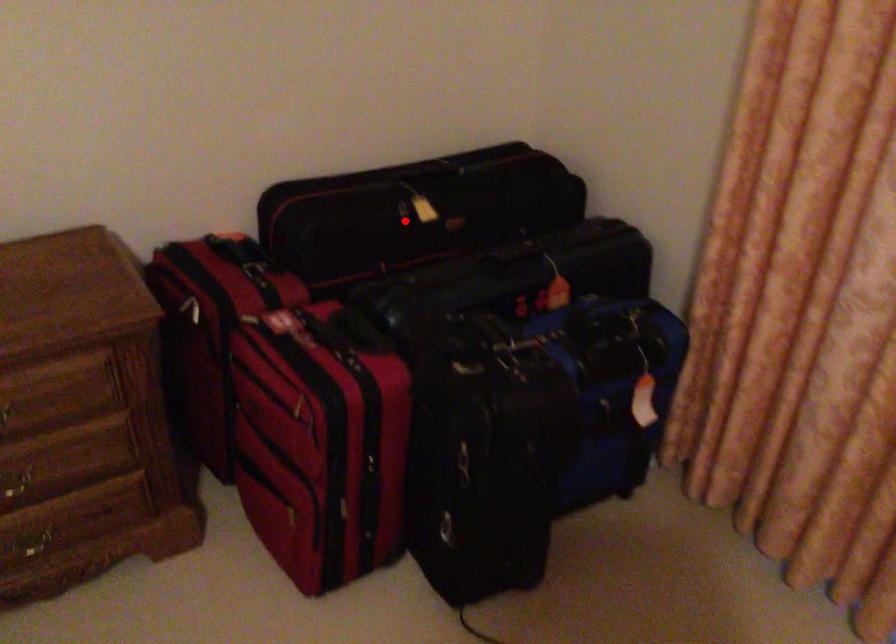
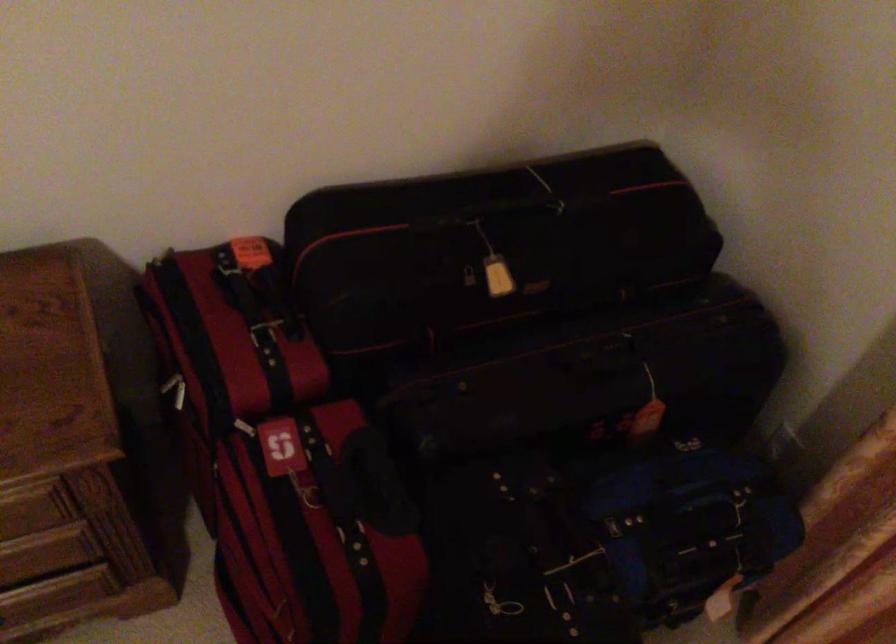
In the second image, find the point that corresponds to the highlighted location in the first image.

(470, 287)